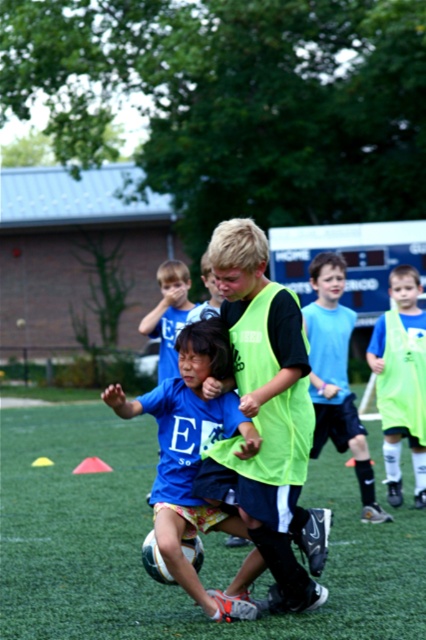
You are a referee observing the soccer match. You notice two players, the blue fabric shirt at center and the neon green vest at right. Which player is positioned more to the left side of the field?

The blue fabric shirt at center is positioned more to the left side of the field compared to the neon green vest at right.

You are a referee observing the soccer match. You notice two neon green items in the field. The neon green jersey at center and the neon green vest at right. Which one is positioned lower in the field?

The neon green jersey at center is located below the neon green vest at right, so the neon green jersey at center is positioned lower in the field.

You are a referee observing a soccer match. You need to ensure players maintain a minimum distance of 3 meters between each other during the game. Are the neon green jersey at center and the neon green vest at right complying with this rule?

The distance between the neon green jersey at center and the neon green vest at right is 3.15 meters, which is just over the required 3 meters. Therefore, they are complying with the rule as they are maintaining the minimum distance.